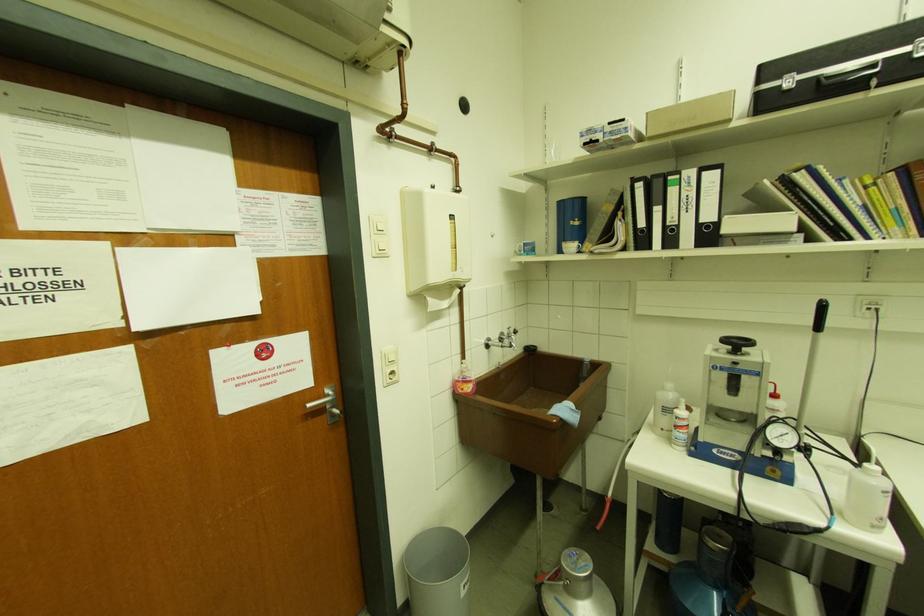
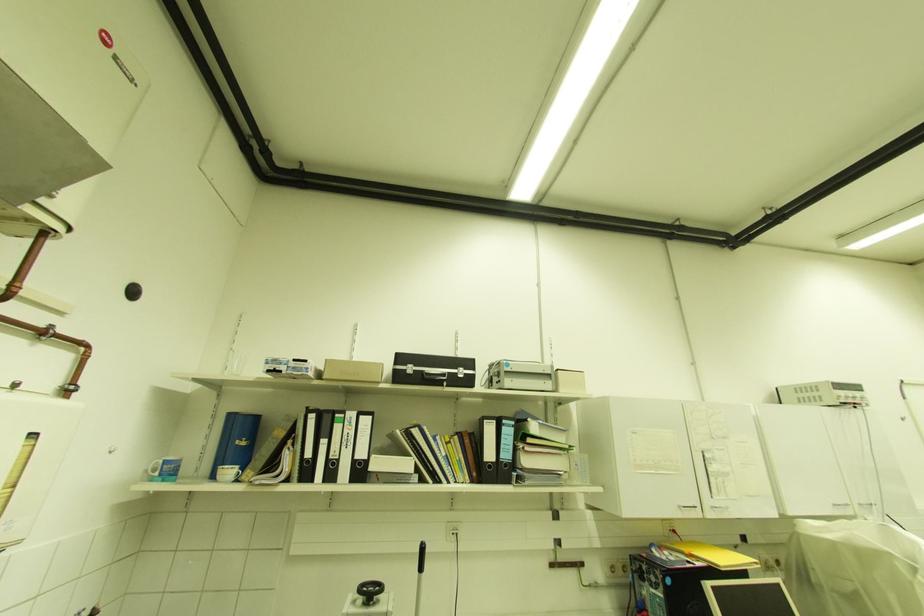
First-person continuous shooting, in which direction is the camera rotating?

The camera's rotation is toward right-up.